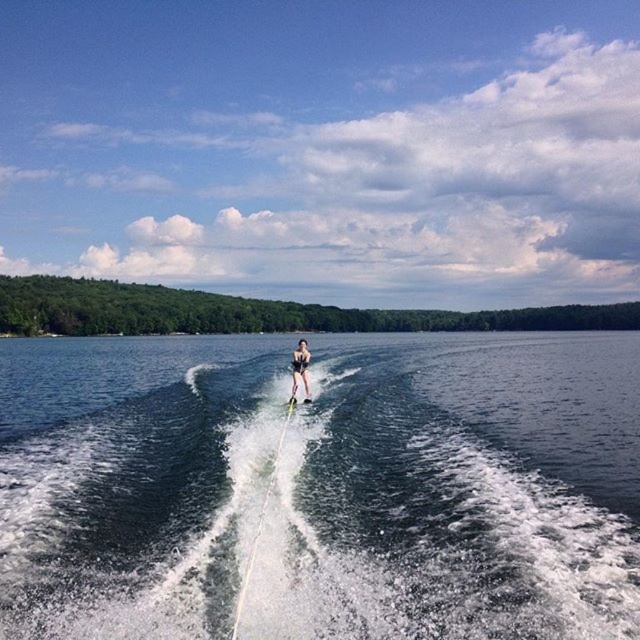
Measure the distance between clear blue water at center and black swimsuit at center.

clear blue water at center and black swimsuit at center are 105.14 feet apart.

This screenshot has width=640, height=640. I want to click on clear blue water at center, so click(321, 486).

Which is behind, point (179, 628) or point (301, 349)?

Point (301, 349)

Where is `clear blue water at center`? This screenshot has width=640, height=640. clear blue water at center is located at coordinates (321, 486).